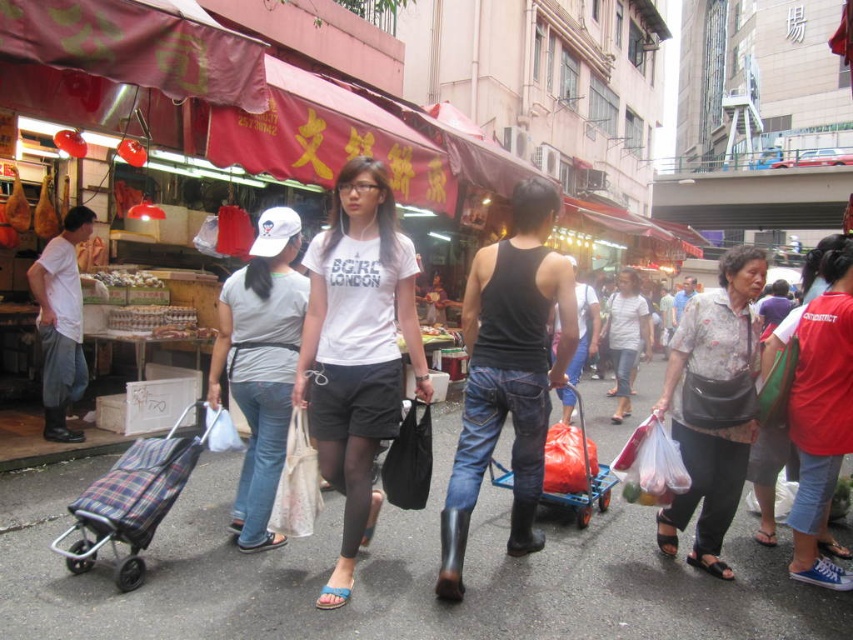
You are standing in the bustling street market scene with modern buildings in the background. You notice two points marked in the image. Which point, point (679,385) or point (112,496), is closer to you?

Point (679,385) is further to the viewer than point (112,496), so point (112,496) is closer to you.

You are a delivery person who needs to park your 2.5 meters long delivery van on the smooth asphalt road at center. The blue plastic cart at center is currently occupying part of the road. Can you fit your van on the road without moving the cart?

The smooth asphalt road at center is shorter than the blue plastic cart at center. Since the road is shorter than the cart, it is likely that the road is not long enough to accommodate a 2.5 meters long delivery van even without moving the cart. Therefore, you cannot fit your van on the road without moving the cart.